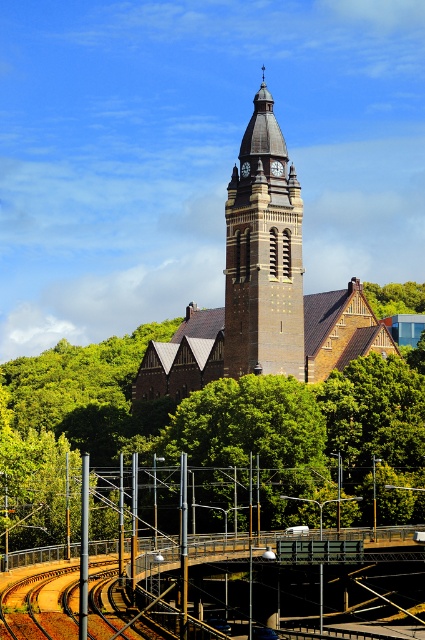
Question: Which is farther from the green leafy tree at upper center?

Choices:
 (A) brown stone clock tower at center
 (B) green leafy tree at center

Answer: (A)

Question: Which point is farther to the camera?

Choices:
 (A) brown stone clock tower at center
 (B) green leafy tree at center

Answer: (A)

Question: Does green leafy tree at center lie behind green leafy tree at upper center?

Choices:
 (A) yes
 (B) no

Answer: (B)

Question: Among these objects, which one is nearest to the camera?

Choices:
 (A) green leafy tree at upper center
 (B) brown stone clock tower at center

Answer: (B)

Question: Considering the relative positions of brown stone clock tower at center and green leafy tree at upper center in the image provided, where is brown stone clock tower at center located with respect to green leafy tree at upper center?

Choices:
 (A) left
 (B) right

Answer: (A)

Question: Can you confirm if green leafy tree at center is wider than green leafy tree at upper center?

Choices:
 (A) no
 (B) yes

Answer: (B)